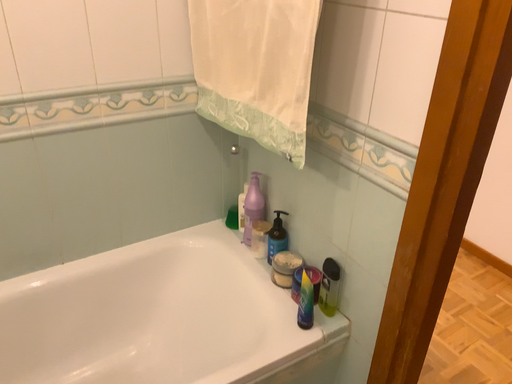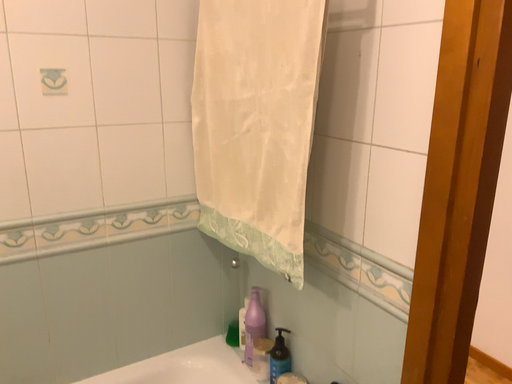
Question: How did the camera likely rotate when shooting the video?

Choices:
 (A) rotated upward
 (B) rotated downward

Answer: (A)